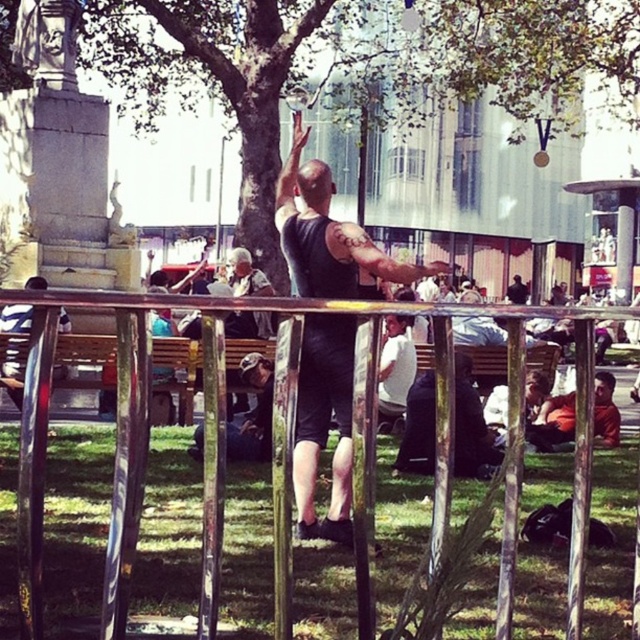
Measure the distance between point (448, 10) and camera.

A: Point (448, 10) and camera are 63.85 meters apart.

Who is taller, green leafy tree at center or metallic silver pole at left?

Standing taller between the two is green leafy tree at center.

This screenshot has height=640, width=640. Find the location of `green leafy tree at center`. green leafy tree at center is located at coordinates (355, 61).

Between metallic silver fence at center and black matte tank top at center, which one appears on the right side from the viewer's perspective?

Positioned to the right is black matte tank top at center.

Which is behind, point (372, 509) or point (323, 214)?

Positioned behind is point (323, 214).

Between point (212, 429) and point (285, 216), which one is positioned behind?

The point (285, 216) is behind.

This screenshot has height=640, width=640. What are the coordinates of `metallic silver fence at center` in the screenshot? It's located at (214, 448).

Does black matte tank top at center have a larger size compared to metallic silver pole at left?

Yes, black matte tank top at center is bigger than metallic silver pole at left.

Can you confirm if black matte tank top at center is positioned below metallic silver pole at left?

No.

Who is more distant from viewer, (433, 266) or (17, 387)?

The point (17, 387) is more distant.

The image size is (640, 640). Find the location of `black matte tank top at center`. black matte tank top at center is located at coordinates (326, 234).